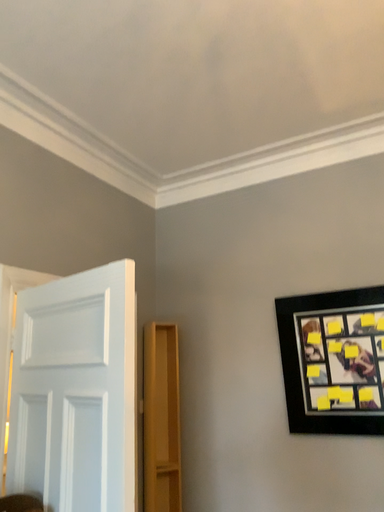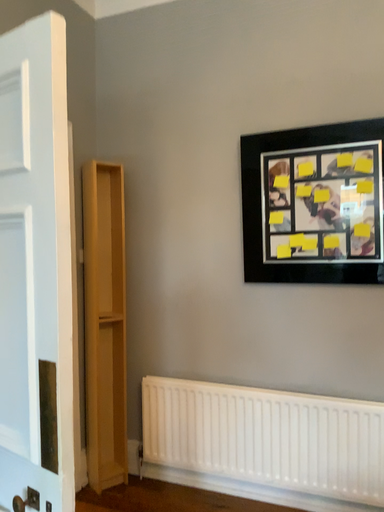
Question: Which way did the camera rotate in the video?

Choices:
 (A) rotated right
 (B) rotated left

Answer: (A)